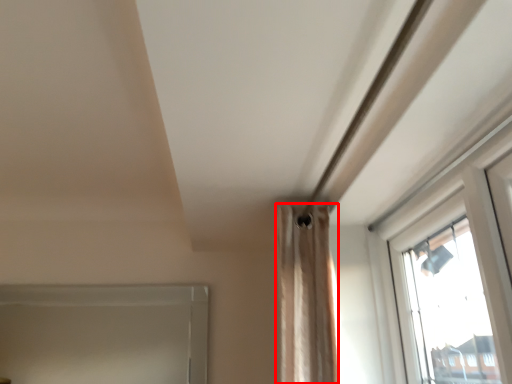
Question: From the image's perspective, what is the correct spatial positioning of curtain (annotated by the red box) in reference to window frame?

Choices:
 (A) above
 (B) below

Answer: (A)